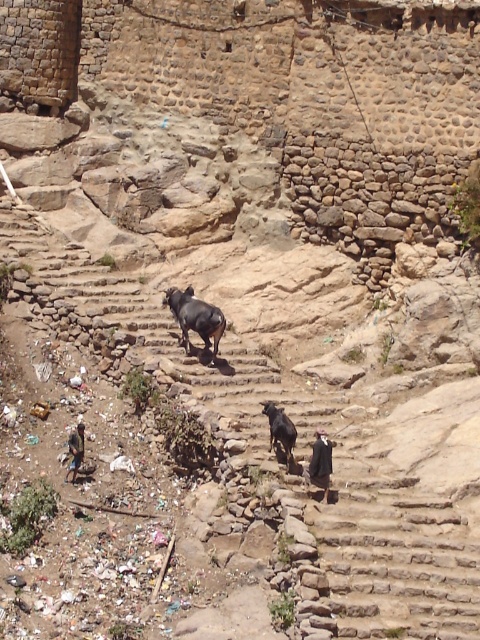
Question: Which point is farther to the camera?

Choices:
 (A) (206, 324)
 (B) (296, 435)

Answer: (A)

Question: Does dark brown glossy cow at center appear over black glossy cow at center?

Choices:
 (A) yes
 (B) no

Answer: (A)

Question: Is dark brown glossy cow at center thinner than black glossy cow at center?

Choices:
 (A) no
 (B) yes

Answer: (A)

Question: Does dark brown glossy cow at center appear over black glossy cow at center?

Choices:
 (A) yes
 (B) no

Answer: (A)